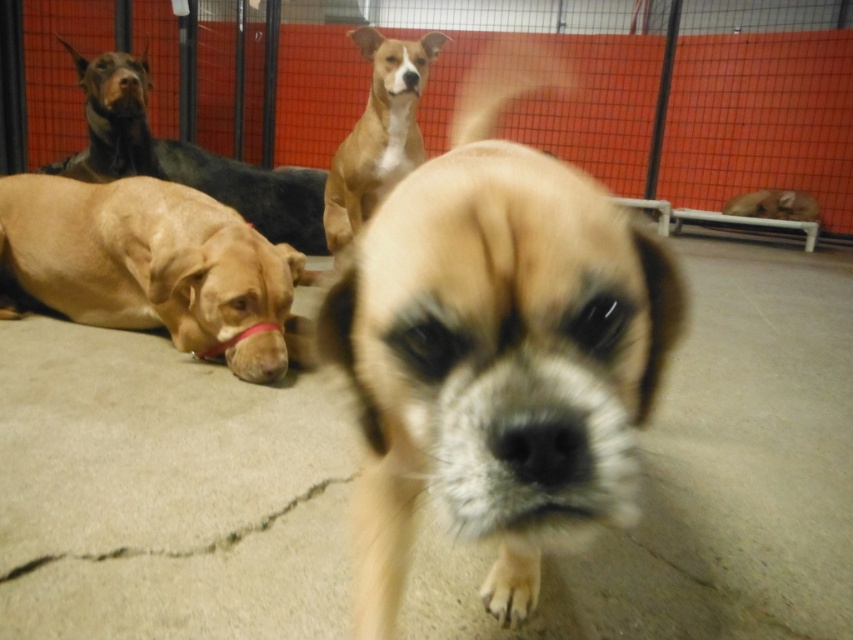
You are a photographer trying to capture a clear shot of the brown smooth dog at upper center. Based on the scene description, where should you focus your camera to ensure the dog is in sharp focus?

You should focus your camera at point (376,132) to ensure the brown smooth dog at upper center is in sharp focus since that is its exact position according to the description.

You are standing at the point marked as point (109, 147) and want to reach the exit located at the opposite corner of the kennel. The kennel has a rectangular layout with walls along the edges. The shortest path to the exit requires moving in a straight line. Given that the distance between you and the exit is 3.67 meters, can you safely navigate this path without obstacles?

The shortest path between point (109, 147) and the exit is 3.67 meters. Since the kennel has a rectangular layout with walls along the edges and no obstacles mentioned, you can safely navigate this path without any issues.

Looking at this image, you are a dog trainer entering the kennel and need to place a 2.5 feet wide barrier between the brown smooth coat at left and the brown matte nose at center. Is there enough space between them to fit the barrier?

The distance between the brown smooth coat at left and the brown matte nose at center is 5.67 feet. Since the barrier is 2.5 feet wide, there is sufficient space to place it between them as 5.67 feet is greater than 2.5 feet.